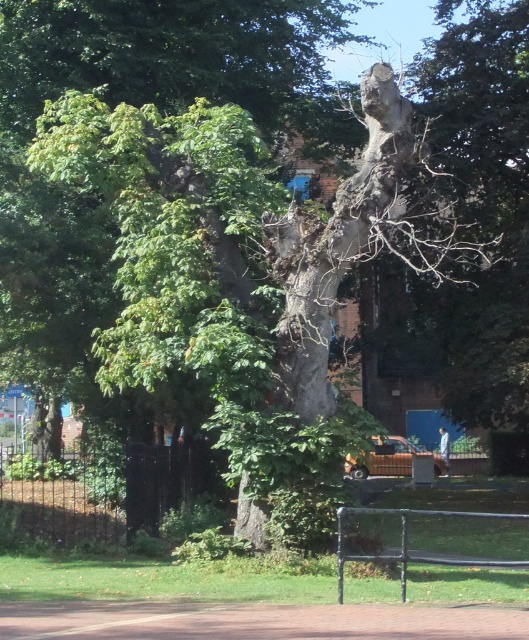
Is smooth gray tree trunk at center shorter than black metal park bench at lower center?

In fact, smooth gray tree trunk at center may be taller than black metal park bench at lower center.

Is smooth gray tree trunk at center above black metal park bench at lower center?

Correct, smooth gray tree trunk at center is located above black metal park bench at lower center.

Is point (152, 3) in front of point (359, 552)?

No, it is not.

Find the location of `smooth gray tree trunk at center`. smooth gray tree trunk at center is located at coordinates (174, 54).